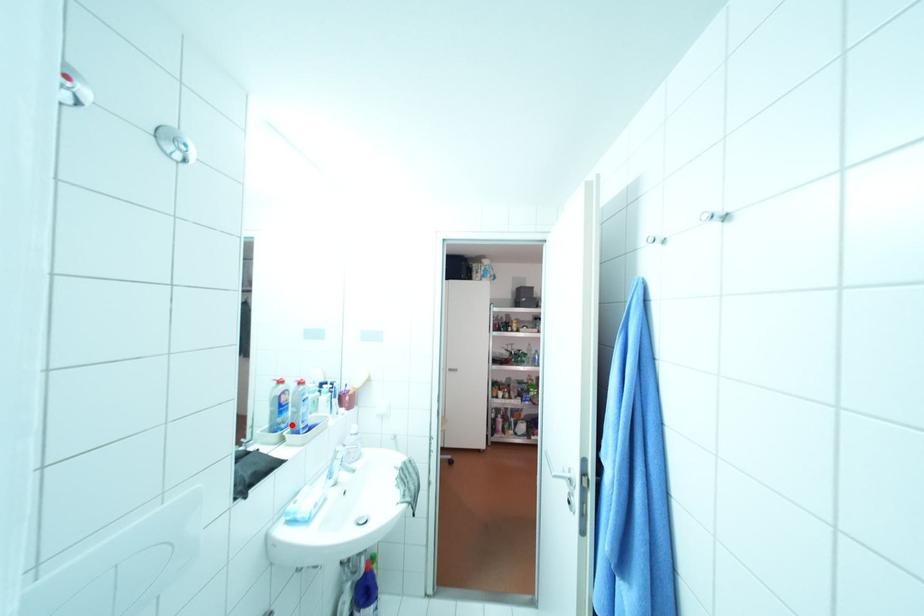
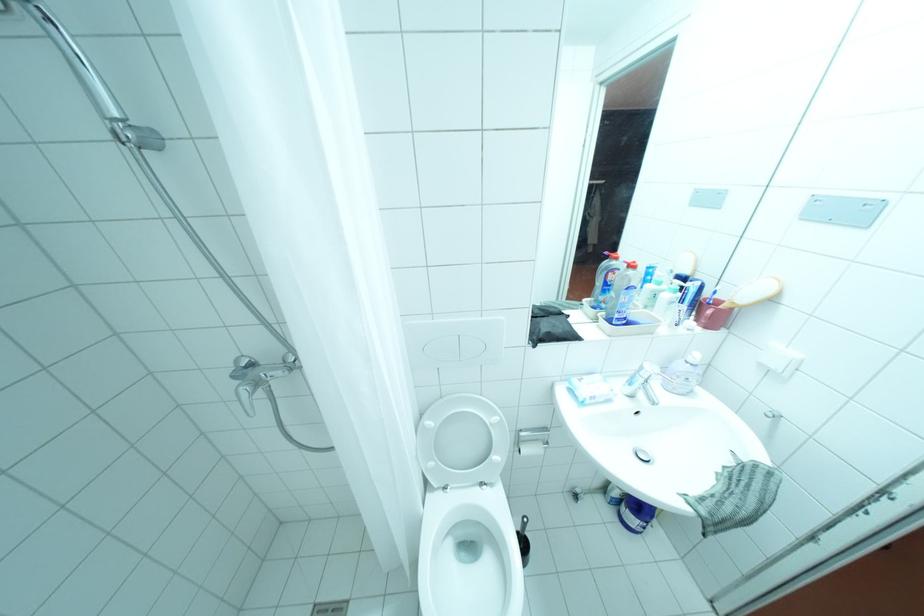
The point at the highlighted location is marked in the first image. Where is the corresponding point in the second image?

(612, 305)